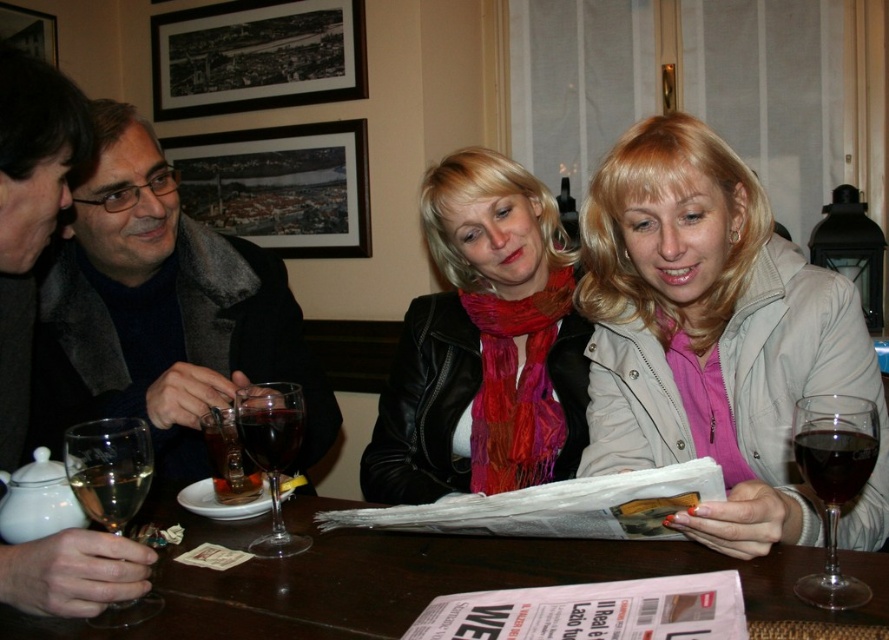
Can you confirm if dark gray wool coat at left is wider than translucent glass wine at center?

Yes, dark gray wool coat at left is wider than translucent glass wine at center.

In the scene shown: Between dark gray wool coat at left and translucent glass wine at center, which one appears on the right side from the viewer's perspective?

translucent glass wine at center

Looking at this image, who is more distant from viewer, [73,289] or [210,435]?

Point [73,289]

Locate an element on the screen. The height and width of the screenshot is (640, 889). dark gray wool coat at left is located at coordinates (161, 312).

Can you confirm if leather jacket at center is positioned to the left of transparent glass wine glass at lower right?

Yes, leather jacket at center is to the left of transparent glass wine glass at lower right.

The image size is (889, 640). Describe the element at coordinates (485, 344) in the screenshot. I see `leather jacket at center` at that location.

Between point (481, 291) and point (827, 522), which one is positioned in front?

Positioned in front is point (827, 522).

This screenshot has height=640, width=889. I want to click on leather jacket at center, so click(x=485, y=344).

Is brown wooden table at center shorter than dark red glass at center?

Yes.

Who is lower down, brown wooden table at center or dark red glass at center?

Positioned lower is brown wooden table at center.

Identify the location of brown wooden table at center. (420, 579).

The width and height of the screenshot is (889, 640). Identify the location of brown wooden table at center. (420, 579).